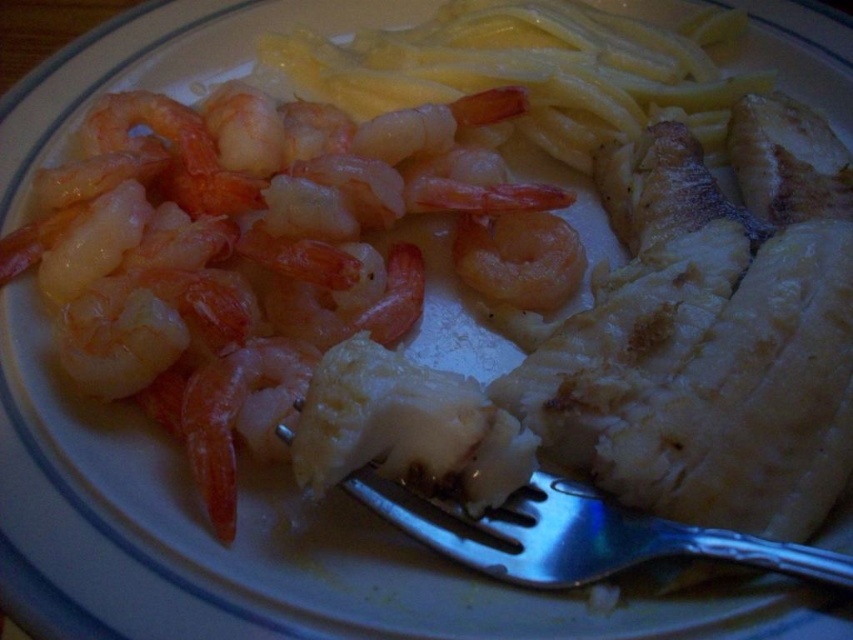
Can you confirm if pink translucent shrimp at upper left is thinner than silver metallic fork at center?

No, pink translucent shrimp at upper left is not thinner than silver metallic fork at center.

Which is more to the right, pink translucent shrimp at upper left or silver metallic fork at center?

Positioned to the right is silver metallic fork at center.

Where is `pink translucent shrimp at upper left`? Image resolution: width=853 pixels, height=640 pixels. pink translucent shrimp at upper left is located at coordinates (267, 252).